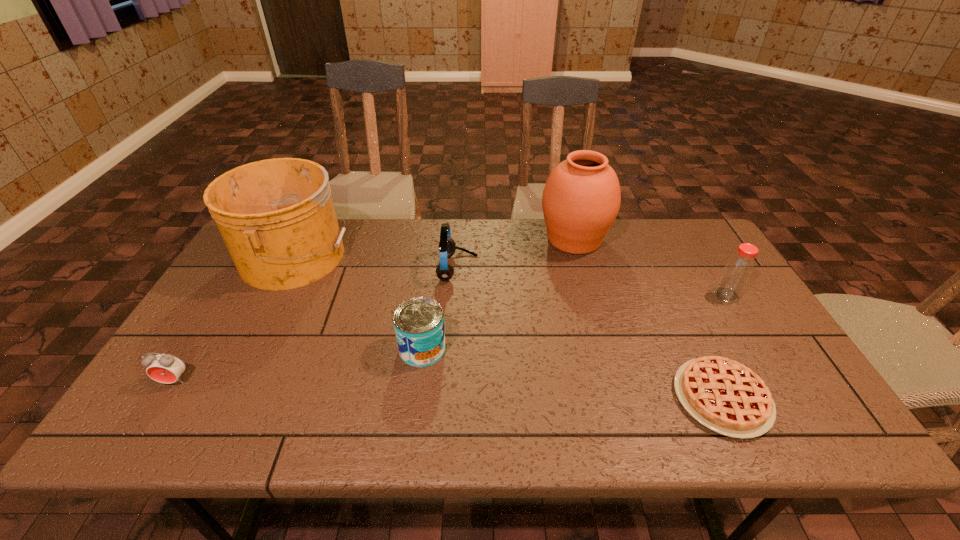
Where is `the sixth closest object to the headset`? This screenshot has width=960, height=540. the sixth closest object to the headset is located at coordinates (738, 270).

Where is `vacant space that satisfies the following two spatial constraints: 1. on the front side of the bottle; 2. on the left side of the urn`? The height and width of the screenshot is (540, 960). vacant space that satisfies the following two spatial constraints: 1. on the front side of the bottle; 2. on the left side of the urn is located at coordinates (589, 295).

At what (x,y) coordinates should I click in order to perform the action: click on free location that satisfies the following two spatial constraints: 1. with the microphone attached to the side of the headset; 2. on the right side of the shortest object. Please return your answer as a coordinate pair (x, y). Looking at the image, I should click on (450, 397).

What are the coordinates of `vacant space that satisfies the following two spatial constraints: 1. with the microphone attached to the side of the rightmost object; 2. on the left side of the headset` in the screenshot? It's located at (456, 295).

You are a GUI agent. You are given a task and a screenshot of the screen. Output one action in this format:
    pyautogui.click(x=<x>, y=<y>)
    Task: Click on the free spot that satisfies the following two spatial constraints: 1. with the microphone attached to the side of the shortest object; 2. on the left side of the headset
    The image size is (960, 540).
    Given the screenshot: What is the action you would take?
    pyautogui.click(x=450, y=397)